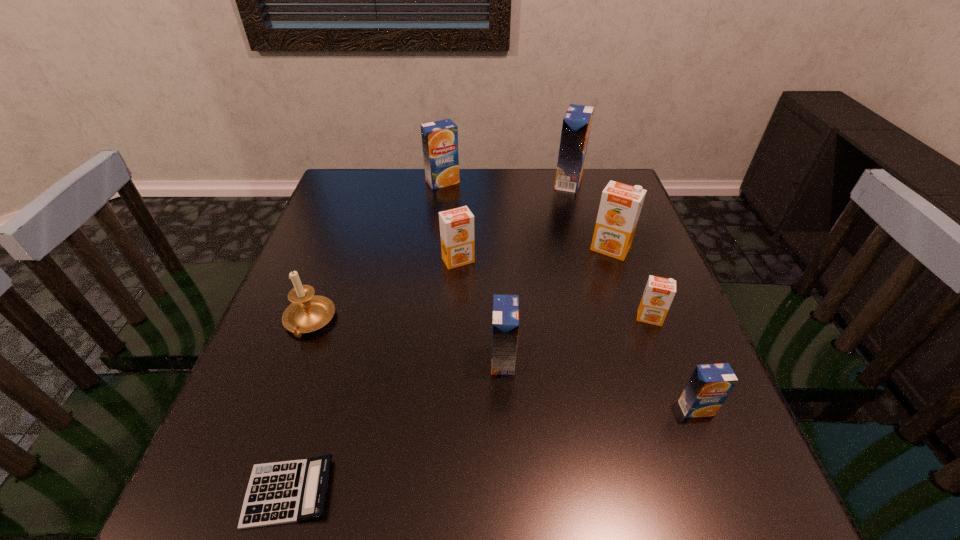
Image resolution: width=960 pixels, height=540 pixels. I want to click on the fifth farthest orange juice, so click(x=659, y=292).

The image size is (960, 540). Identify the location of the nearest orange orange juice. (659, 292).

The width and height of the screenshot is (960, 540). I want to click on calculator, so click(284, 492).

Where is `the nearest object`? The image size is (960, 540). the nearest object is located at coordinates (284, 492).

The height and width of the screenshot is (540, 960). I want to click on blank area located on the left of the second blue orange_juice from right to left, so click(490, 182).

Find the location of `vacant space located on the right of the third smallest blue orange_juice`. vacant space located on the right of the third smallest blue orange_juice is located at coordinates click(559, 182).

Locate an element on the screen. This screenshot has height=540, width=960. vacant position located 0.310m on the front of the biggest orange orange juice is located at coordinates (650, 367).

Identify the location of free location located 0.060m on the front of the second biggest orange orange juice. The height and width of the screenshot is (540, 960). (457, 287).

Find the location of a particular element. The height and width of the screenshot is (540, 960). free location located on the left of the fifth orange juice from right to left is located at coordinates (296, 360).

You are a GUI agent. You are given a task and a screenshot of the screen. Output one action in this format:
    pyautogui.click(x=<x>, y=<y>)
    Task: Click on the vacant area located with a handle on the side of the beige candle holder
    Image resolution: width=960 pixels, height=540 pixels.
    Given the screenshot: What is the action you would take?
    pyautogui.click(x=233, y=524)